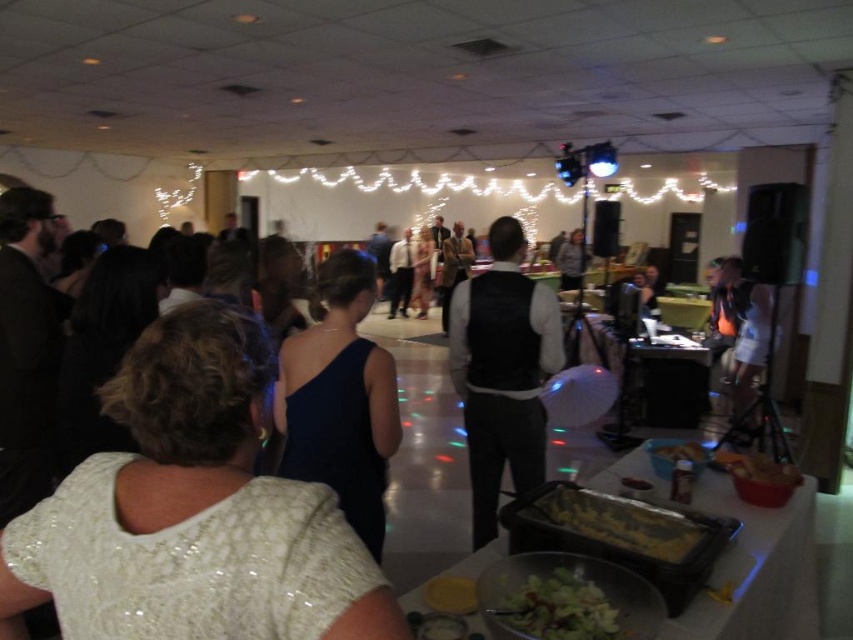
Question: Can you confirm if yellow matte cake at lower center is positioned below golden brown bread at center?

Choices:
 (A) no
 (B) yes

Answer: (B)

Question: Which object is farther from the camera taking this photo?

Choices:
 (A) white fabric dress at right
 (B) navy blue dress at center
 (C) golden brown bread at center

Answer: (A)

Question: Can you confirm if navy blue dress at center is positioned below yellow matte cake at lower center?

Choices:
 (A) yes
 (B) no

Answer: (B)

Question: Which point is closer to the camera taking this photo?

Choices:
 (A) (689, 518)
 (B) (677, 458)
 (C) (482, 403)
 (D) (544, 573)

Answer: (D)

Question: Can you confirm if white sequined dress at upper left is wider than black leather vest at center?

Choices:
 (A) yes
 (B) no

Answer: (A)

Question: Which object is closer to the camera taking this photo?

Choices:
 (A) white sequined dress at upper left
 (B) navy blue dress at center

Answer: (A)